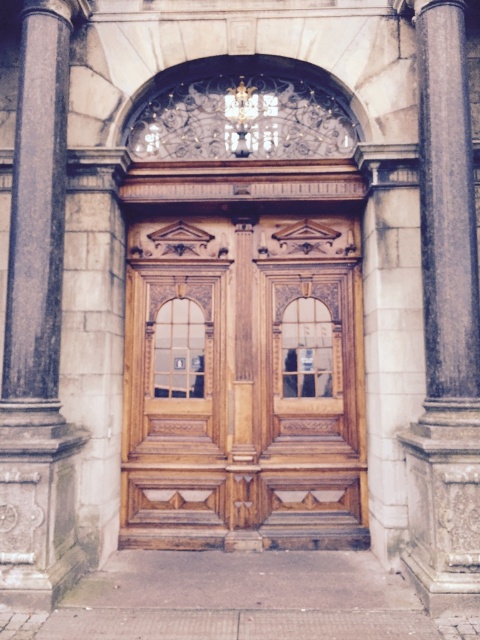
Question: Is dark gray stone pillar at left wider than brown polished stone column at right?

Choices:
 (A) no
 (B) yes

Answer: (B)

Question: Among these points, which one is farthest from the camera?

Choices:
 (A) (229, 364)
 (B) (21, 177)
 (C) (454, 228)

Answer: (A)

Question: Is wooden door at center behind brown polished stone column at right?

Choices:
 (A) no
 (B) yes

Answer: (B)

Question: Which of the following is the closest to the observer?

Choices:
 (A) (469, 173)
 (B) (300, 220)
 (C) (1, 380)

Answer: (C)

Question: Which object appears farthest from the camera in this image?

Choices:
 (A) dark gray stone pillar at left
 (B) brown polished stone column at right
 (C) wooden door at center

Answer: (C)

Question: Does wooden door at center have a greater width compared to dark gray stone pillar at left?

Choices:
 (A) no
 (B) yes

Answer: (B)